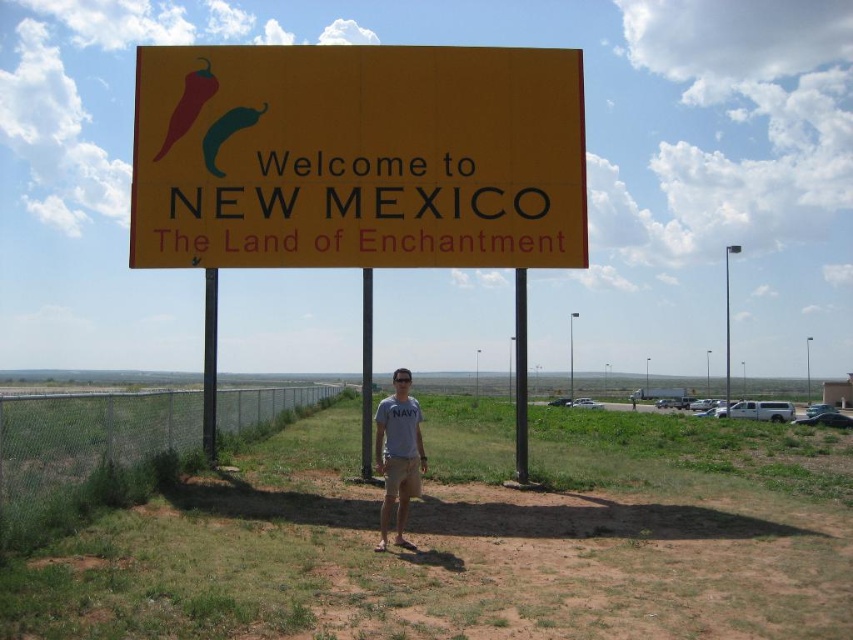
Question: Does yellow matte sign at upper center have a lesser width compared to gray cotton shirt at center?

Choices:
 (A) no
 (B) yes

Answer: (A)

Question: Can you confirm if yellow matte sign at upper center is positioned to the left of green matte chili pepper at upper center?

Choices:
 (A) yes
 (B) no

Answer: (B)

Question: Is gray cotton shirt at center thinner than matte red pepper at upper left?

Choices:
 (A) yes
 (B) no

Answer: (A)

Question: Which of the following is the farthest from the observer?

Choices:
 (A) yellow matte sign at upper center
 (B) gray cotton shirt at center
 (C) matte red pepper at upper left
 (D) green matte chili pepper at upper center

Answer: (C)

Question: Which point is closer to the camera taking this photo?

Choices:
 (A) (160, 152)
 (B) (219, 125)
 (C) (363, 248)
 (D) (421, 460)

Answer: (D)

Question: Among these points, which one is nearest to the camera?

Choices:
 (A) (393, 474)
 (B) (165, 154)
 (C) (229, 132)

Answer: (A)